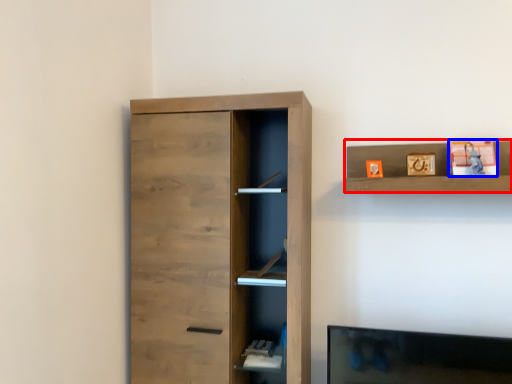
Question: Which of the following is the farthest to the observer, shelf (highlighted by a red box) or toy (highlighted by a blue box)?

Choices:
 (A) shelf
 (B) toy

Answer: (B)